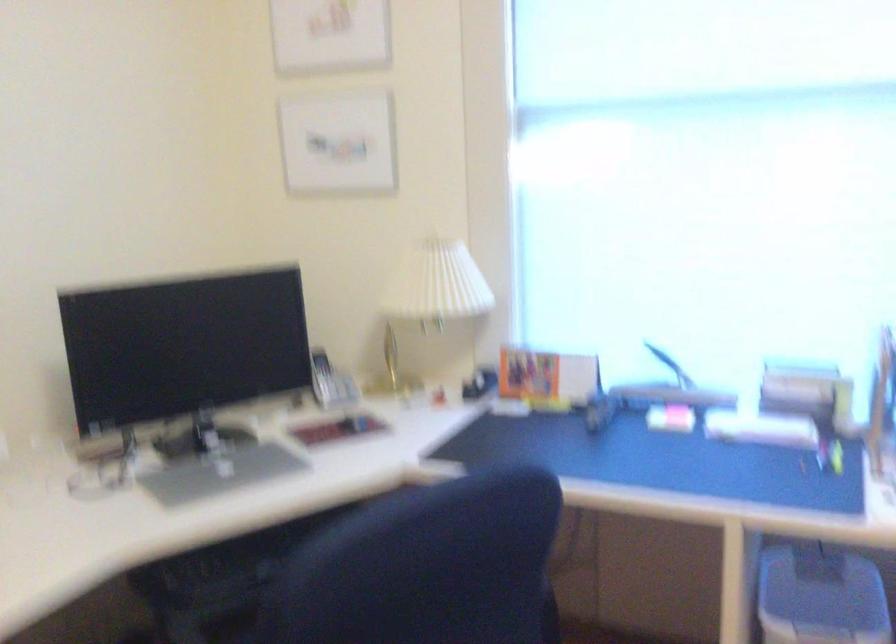
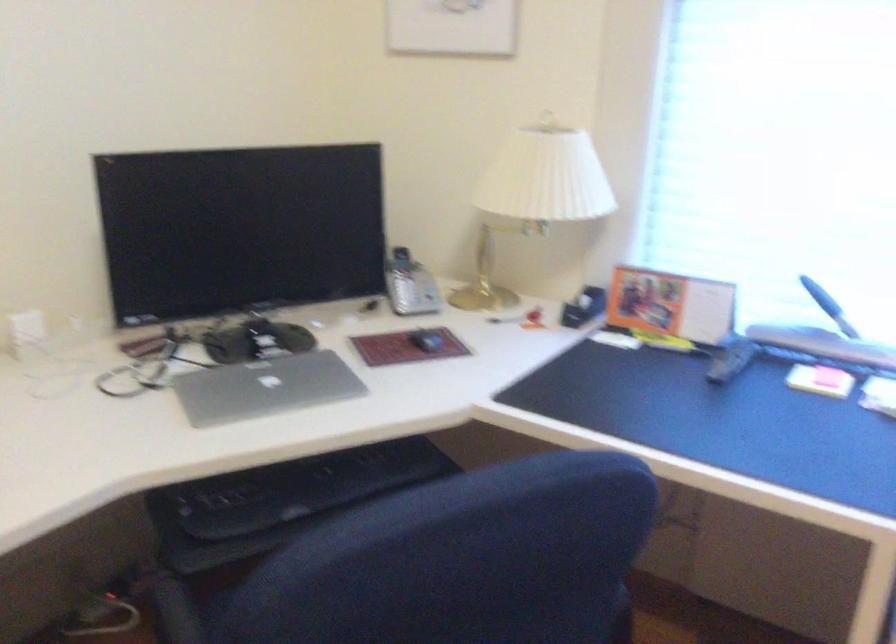
The point at (681, 418) is marked in the first image. Where is the corresponding point in the second image?

(829, 377)